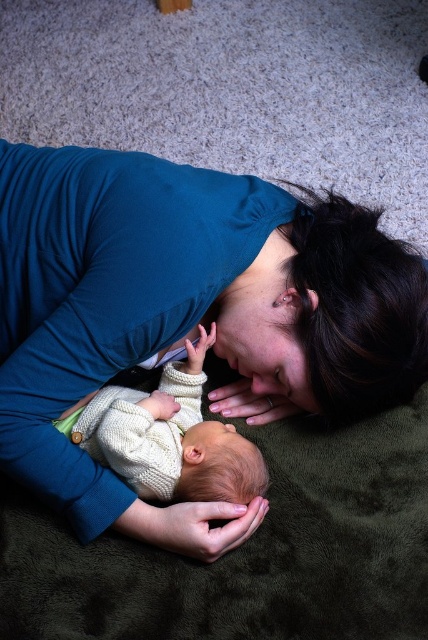
Question: Can you confirm if blue fabric at center is positioned above knitted cream sweater at center?

Choices:
 (A) no
 (B) yes

Answer: (B)

Question: Is blue fabric at center further to the viewer compared to knitted cream sweater at center?

Choices:
 (A) no
 (B) yes

Answer: (A)

Question: Is blue fabric at center above knitted cream sweater at center?

Choices:
 (A) yes
 (B) no

Answer: (A)

Question: Which point is closer to the camera taking this photo?

Choices:
 (A) (149, 509)
 (B) (175, 426)

Answer: (A)